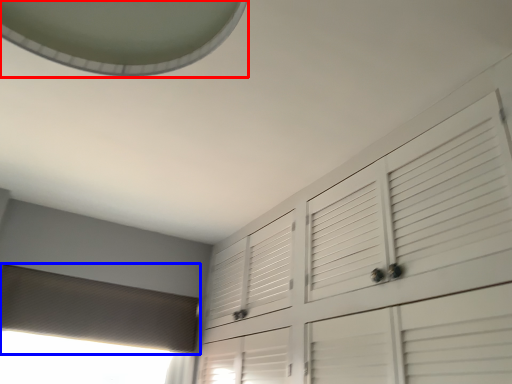
Question: Which object appears farthest to the camera in this image, exhaust hood (highlighted by a red box) or blind (highlighted by a blue box)?

Choices:
 (A) exhaust hood
 (B) blind

Answer: (B)